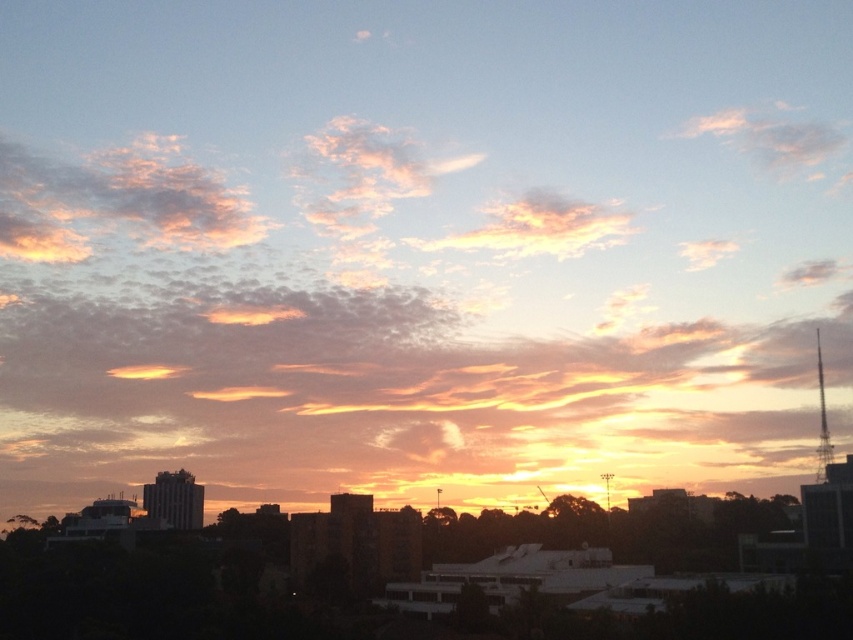
You are an urban planner analyzing the sunset view from a new observation deck. You notice the pastel pink cotton clouds at upper left and the pastel cotton clouds at center. Which cloud formation is positioned higher in the sky?

The pastel pink cotton clouds at upper left are positioned higher in the sky than the pastel cotton clouds at center according to their placement in the image.